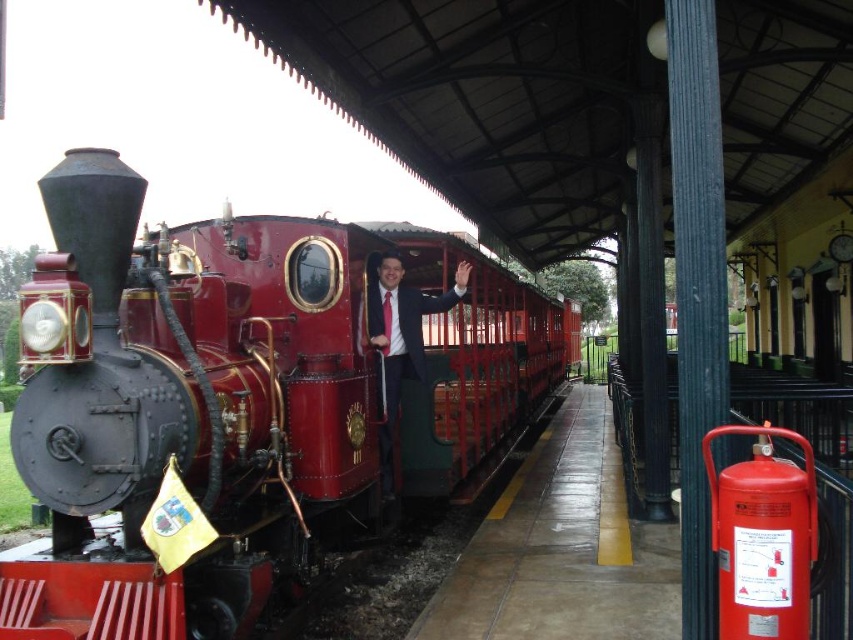
Based on the photo, can you confirm if shiny red locomotive at center is wider than matte black suit at center?

Correct, the width of shiny red locomotive at center exceeds that of matte black suit at center.

You are a GUI agent. You are given a task and a screenshot of the screen. Output one action in this format:
    pyautogui.click(x=<x>, y=<y>)
    Task: Click on the shiny red locomotive at center
    Image resolution: width=853 pixels, height=640 pixels.
    Given the screenshot: What is the action you would take?
    pyautogui.click(x=242, y=401)